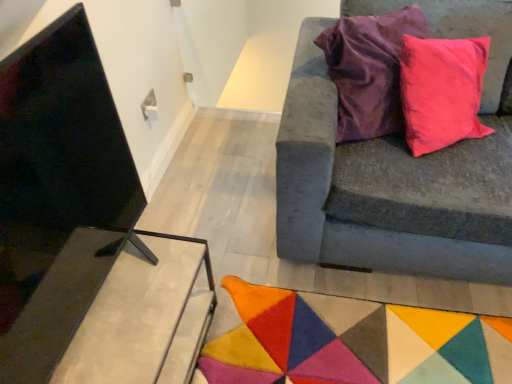
Question: Is velvet gray couch at right at the right side of multicolored felt mat at lower center?

Choices:
 (A) no
 (B) yes

Answer: (B)

Question: Is velvet gray couch at right positioned in front of multicolored felt mat at lower center?

Choices:
 (A) no
 (B) yes

Answer: (B)

Question: Does velvet gray couch at right have a greater height compared to multicolored felt mat at lower center?

Choices:
 (A) yes
 (B) no

Answer: (A)

Question: Would you say multicolored felt mat at lower center is part of velvet gray couch at right's contents?

Choices:
 (A) yes
 (B) no

Answer: (B)

Question: Can you confirm if velvet gray couch at right is thinner than multicolored felt mat at lower center?

Choices:
 (A) yes
 (B) no

Answer: (A)

Question: From the image's perspective, relative to metallic concrete table at lower left, is velvet gray couch at right above or below?

Choices:
 (A) below
 (B) above

Answer: (B)

Question: From a real-world perspective, is velvet gray couch at right physically located above or below metallic concrete table at lower left?

Choices:
 (A) below
 (B) above

Answer: (B)

Question: Looking at the image, does velvet gray couch at right seem bigger or smaller compared to metallic concrete table at lower left?

Choices:
 (A) small
 (B) big

Answer: (B)

Question: In the image, is velvet gray couch at right positioned in front of or behind metallic concrete table at lower left?

Choices:
 (A) behind
 (B) front

Answer: (B)

Question: Based on their sizes in the image, would you say velvet gray couch at right is bigger or smaller than multicolored felt mat at lower center?

Choices:
 (A) small
 (B) big

Answer: (B)

Question: In the image, is velvet gray couch at right on the left side or the right side of multicolored felt mat at lower center?

Choices:
 (A) left
 (B) right

Answer: (B)

Question: From a real-world perspective, is velvet gray couch at right positioned above or below multicolored felt mat at lower center?

Choices:
 (A) above
 (B) below

Answer: (A)

Question: From the image's perspective, is velvet gray couch at right located above or below multicolored felt mat at lower center?

Choices:
 (A) above
 (B) below

Answer: (A)

Question: Looking at the image, does metallic concrete table at lower left seem bigger or smaller compared to velvet gray couch at right?

Choices:
 (A) small
 (B) big

Answer: (A)

Question: Is metallic concrete table at lower left inside or outside of velvet gray couch at right?

Choices:
 (A) outside
 (B) inside

Answer: (A)